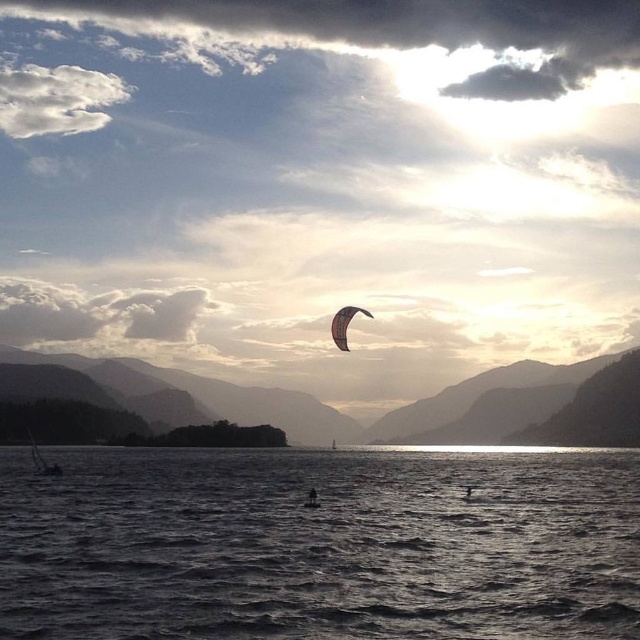
Question: Is translucent white kite at center wider than dark skin person at center?

Choices:
 (A) no
 (B) yes

Answer: (B)

Question: Which point is closer to the camera?

Choices:
 (A) (317, 506)
 (B) (468, 497)
 (C) (465, 454)

Answer: (A)

Question: Which of the following is the closest to the observer?

Choices:
 (A) (314, 490)
 (B) (332, 321)
 (C) (627, 541)

Answer: (C)

Question: Does dark gray water at center appear on the right side of dark skin person at center?

Choices:
 (A) yes
 (B) no

Answer: (A)

Question: Is translucent white kite at center above dark skin person at center?

Choices:
 (A) no
 (B) yes

Answer: (B)

Question: Among these points, which one is nearest to the camera?

Choices:
 (A) (337, 332)
 (B) (468, 486)
 (C) (312, 486)

Answer: (B)